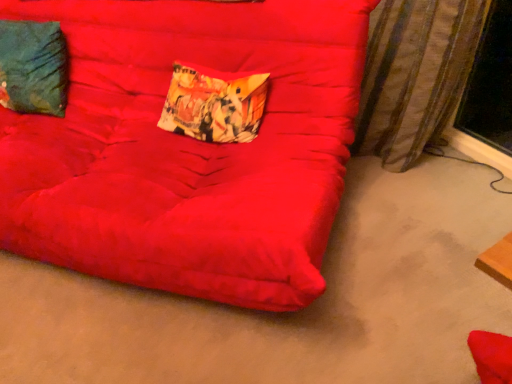
Question: Considering the relative sizes of printed fabric pillow at center, arranged as the second pillow when viewed from the left, and suede-like red futon at center in the image provided, is printed fabric pillow at center, arranged as the second pillow when viewed from the left, bigger than suede-like red futon at center?

Choices:
 (A) no
 (B) yes

Answer: (A)

Question: From the image's perspective, does printed fabric pillow at center, which is the 1th pillow from right to left, appear lower than suede-like red futon at center?

Choices:
 (A) yes
 (B) no

Answer: (B)

Question: Is suede-like red futon at center surrounded by printed fabric pillow at center, which is the 1th pillow from right to left?

Choices:
 (A) no
 (B) yes

Answer: (A)

Question: Does printed fabric pillow at center, arranged as the second pillow when viewed from the left, have a greater width compared to suede-like red futon at center?

Choices:
 (A) yes
 (B) no

Answer: (B)

Question: Can you confirm if printed fabric pillow at center, which is the 1th pillow from right to left, is shorter than suede-like red futon at center?

Choices:
 (A) no
 (B) yes

Answer: (B)

Question: Does printed fabric pillow at center, which is the 1th pillow from right to left, appear on the right side of suede-like red futon at center?

Choices:
 (A) yes
 (B) no

Answer: (A)

Question: Is teal fabric pillow at upper left, arranged as the 1th pillow when viewed from the left, next to printed fabric pillow at center, arranged as the second pillow when viewed from the left, and touching it?

Choices:
 (A) yes
 (B) no

Answer: (B)

Question: Is teal fabric pillow at upper left, the 2th pillow positioned from the right, further to camera compared to printed fabric pillow at center, which is the 1th pillow from right to left?

Choices:
 (A) yes
 (B) no

Answer: (A)

Question: Considering the relative positions of teal fabric pillow at upper left, arranged as the 1th pillow when viewed from the left, and printed fabric pillow at center, arranged as the second pillow when viewed from the left, in the image provided, is teal fabric pillow at upper left, arranged as the 1th pillow when viewed from the left, to the right of printed fabric pillow at center, arranged as the second pillow when viewed from the left, from the viewer's perspective?

Choices:
 (A) no
 (B) yes

Answer: (A)

Question: Is printed fabric pillow at center, which is the 1th pillow from right to left, located within teal fabric pillow at upper left, the 2th pillow positioned from the right?

Choices:
 (A) yes
 (B) no

Answer: (B)

Question: Is teal fabric pillow at upper left, arranged as the 1th pillow when viewed from the left, not close to printed fabric pillow at center, arranged as the second pillow when viewed from the left?

Choices:
 (A) yes
 (B) no

Answer: (B)

Question: Considering the relative sizes of teal fabric pillow at upper left, arranged as the 1th pillow when viewed from the left, and printed fabric pillow at center, which is the 1th pillow from right to left, in the image provided, is teal fabric pillow at upper left, arranged as the 1th pillow when viewed from the left, wider than printed fabric pillow at center, which is the 1th pillow from right to left,?

Choices:
 (A) yes
 (B) no

Answer: (A)

Question: From the image's perspective, does suede-like red futon at center appear lower than printed fabric pillow at center, arranged as the second pillow when viewed from the left?

Choices:
 (A) no
 (B) yes

Answer: (B)